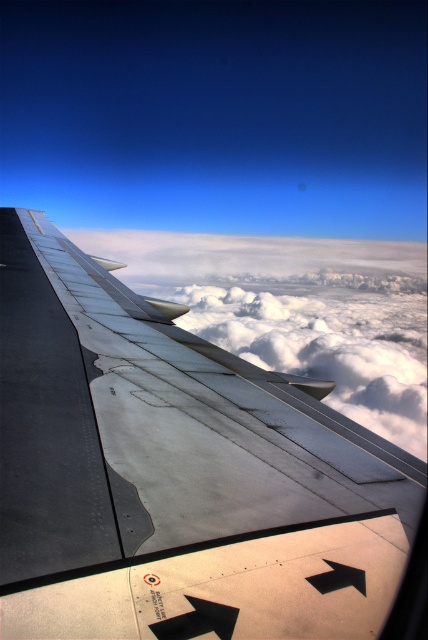
Question: Which point is farther from the camera taking this photo?

Choices:
 (A) (345, 632)
 (B) (264, 353)

Answer: (B)

Question: Can you confirm if metallic gray wing at upper left is positioned to the right of white fluffy cloud at upper center?

Choices:
 (A) yes
 (B) no

Answer: (B)

Question: Among these points, which one is nearest to the camera?

Choices:
 (A) (205, 436)
 (B) (332, 288)

Answer: (A)

Question: Does metallic gray wing at upper left appear under white fluffy cloud at upper center?

Choices:
 (A) yes
 (B) no

Answer: (B)

Question: Considering the relative positions of metallic gray wing at upper left and white fluffy cloud at upper center in the image provided, where is metallic gray wing at upper left located with respect to white fluffy cloud at upper center?

Choices:
 (A) right
 (B) left

Answer: (B)

Question: Which point is farther from the camera taking this photo?

Choices:
 (A) (0, 288)
 (B) (388, 346)

Answer: (B)